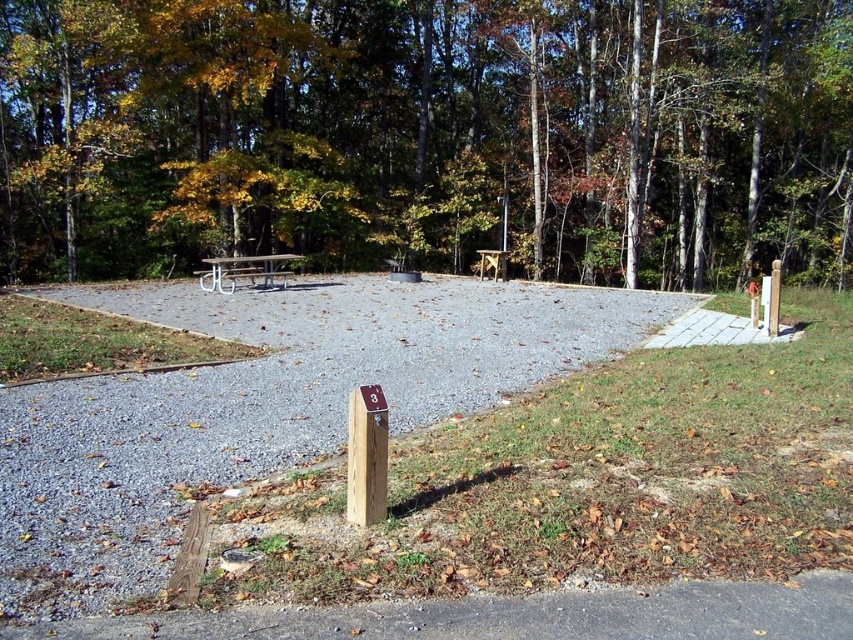
Can you confirm if white concrete path at right is bigger than white plastic bench at center?

Indeed, white concrete path at right has a larger size compared to white plastic bench at center.

Does white concrete path at right come behind white plastic bench at center?

No, it is not.

This screenshot has height=640, width=853. In order to click on white concrete path at right in this screenshot , I will do `click(717, 330)`.

Who is taller, metallic silver picnic table at center or white plastic bench at center?

With more height is metallic silver picnic table at center.

Is metallic silver picnic table at center below white plastic bench at center?

No.

Does point (270, 276) come farther from viewer compared to point (264, 284)?

No, it is in front of (264, 284).

Identify the location of metallic silver picnic table at center. The height and width of the screenshot is (640, 853). pos(245,272).

Which is below, gray asphalt at lower center or white plastic bench at center?

gray asphalt at lower center is below.

Does point (612, 624) come behind point (224, 280)?

No, (612, 624) is closer to viewer.

Does point (804, 580) come in front of point (223, 282)?

Yes, it is.

This screenshot has width=853, height=640. I want to click on gray asphalt at lower center, so [x=514, y=616].